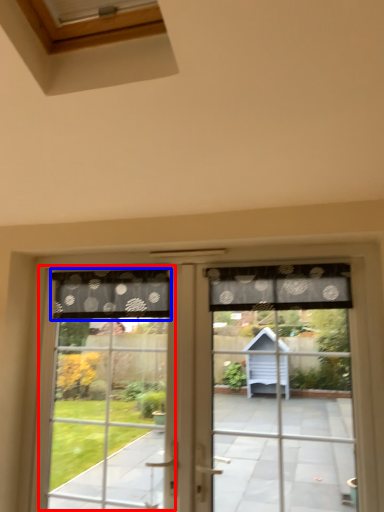
Question: Which object appears farthest to the camera in this image, bay window (highlighted by a red box) or curtain (highlighted by a blue box)?

Choices:
 (A) bay window
 (B) curtain

Answer: (B)